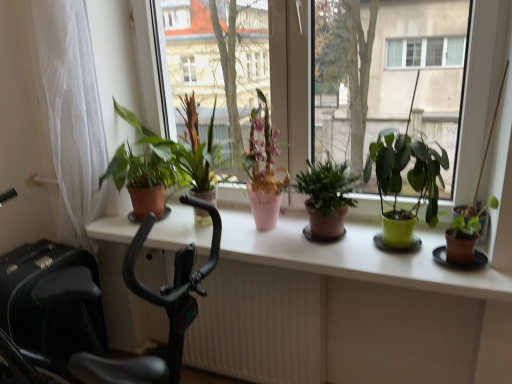
Question: Can you confirm if brown matte pot at right, which is counted as the first houseplant, starting from the right, is smaller than green matte plant pot at center?

Choices:
 (A) no
 (B) yes

Answer: (B)

Question: From a real-world perspective, is brown matte pot at right, arranged as the fifth houseplant when viewed from the left, under green matte plant pot at center?

Choices:
 (A) no
 (B) yes

Answer: (B)

Question: Is brown matte pot at right, arranged as the fifth houseplant when viewed from the left, at the left side of green matte plant pot at center?

Choices:
 (A) yes
 (B) no

Answer: (B)

Question: From the image's perspective, is brown matte pot at right, arranged as the fifth houseplant when viewed from the left, above green matte plant pot at center?

Choices:
 (A) no
 (B) yes

Answer: (A)

Question: Can you confirm if brown matte pot at right, which is counted as the first houseplant, starting from the right, is wider than green matte plant pot at center?

Choices:
 (A) yes
 (B) no

Answer: (A)

Question: From the image's perspective, relative to green matte plant at center, which is counted as the second houseplant, starting from the right, is white textured radiator at lower center above or below?

Choices:
 (A) above
 (B) below

Answer: (B)

Question: In the image, is white textured radiator at lower center positioned in front of or behind green matte plant at center, which is the 4th houseplant in left-to-right order?

Choices:
 (A) behind
 (B) front

Answer: (A)

Question: Is point (233, 279) positioned closer to the camera than point (394, 140)?

Choices:
 (A) farther
 (B) closer

Answer: (A)

Question: Based on their sizes in the image, would you say white textured radiator at lower center is bigger or smaller than green matte plant at center, which is the 4th houseplant in left-to-right order?

Choices:
 (A) small
 (B) big

Answer: (B)

Question: From a real-world perspective, relative to black plastic exercise bike at left, is green matte plant pot at center vertically above or below?

Choices:
 (A) below
 (B) above

Answer: (B)

Question: In the image, is green matte plant pot at center positioned in front of or behind black plastic exercise bike at left?

Choices:
 (A) behind
 (B) front

Answer: (A)

Question: Visually, is green matte plant pot at center positioned to the left or to the right of black plastic exercise bike at left?

Choices:
 (A) right
 (B) left

Answer: (A)

Question: Is green matte plant pot at center bigger or smaller than black plastic exercise bike at left?

Choices:
 (A) big
 (B) small

Answer: (B)

Question: Is white sheer curtain at left to the left or to the right of pink ceramic vase at center, which is the 4th houseplant from right to left, in the image?

Choices:
 (A) left
 (B) right

Answer: (A)

Question: From a real-world perspective, is white sheer curtain at left positioned above or below pink ceramic vase at center, which ranks as the 2th houseplant in left-to-right order?

Choices:
 (A) below
 (B) above

Answer: (B)